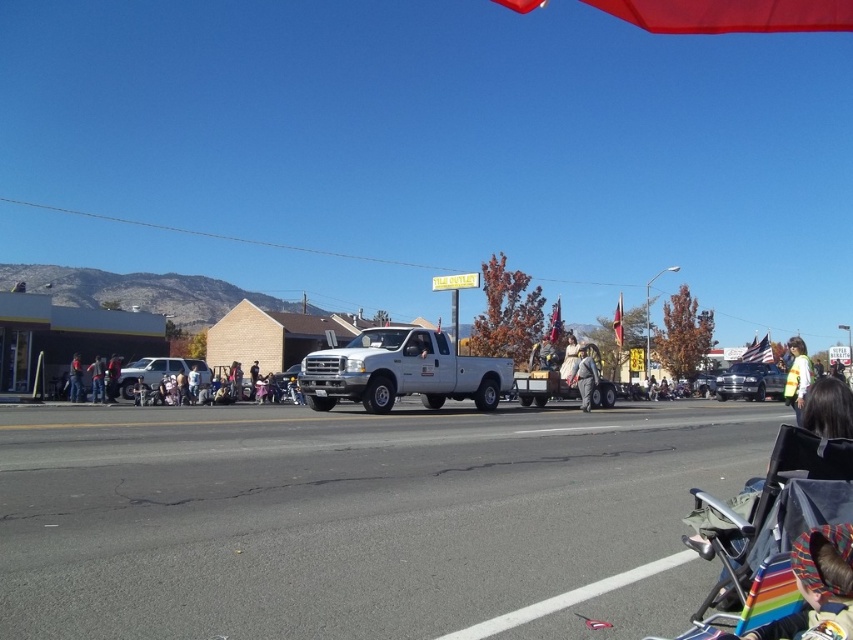
Is rainbow fabric baby carrier at lower right below light blue denim jeans at lower left?

Actually, rainbow fabric baby carrier at lower right is above light blue denim jeans at lower left.

Consider the image. Is rainbow fabric baby carrier at lower right further to the viewer compared to light blue denim jeans at lower left?

No, rainbow fabric baby carrier at lower right is closer to the viewer.

Image resolution: width=853 pixels, height=640 pixels. Identify the location of rainbow fabric baby carrier at lower right. 817,586.

Is point (795, 380) positioned before point (229, 376)?

Yes.

Is point (799, 344) behind point (234, 394)?

No, (799, 344) is closer to viewer.

Image resolution: width=853 pixels, height=640 pixels. Identify the location of yellow reflective vest at lower right. (798, 376).

Does white matte truck at center have a lesser height compared to denim jacket at center?

No, white matte truck at center is not shorter than denim jacket at center.

The width and height of the screenshot is (853, 640). Describe the element at coordinates (401, 371) in the screenshot. I see `white matte truck at center` at that location.

I want to click on white matte truck at center, so click(x=401, y=371).